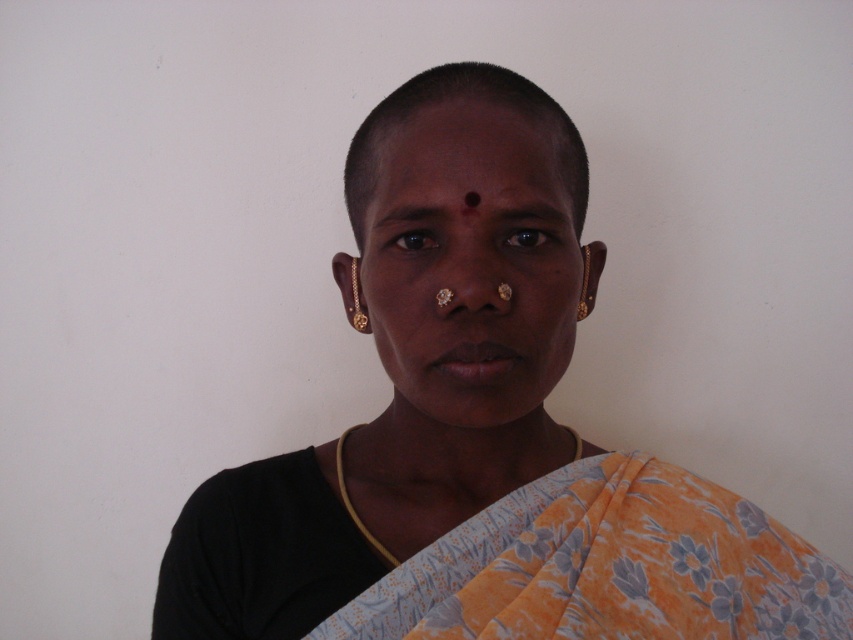
Who is taller, floral orange sari at lower center or matte gold nose ring at center?

Standing taller between the two is matte gold nose ring at center.

Between floral orange sari at lower center and matte gold nose ring at center, which one is positioned higher?

Positioned higher is matte gold nose ring at center.

Locate an element on the screen. floral orange sari at lower center is located at coordinates (608, 566).

Which is behind, point (378, 346) or point (431, 224)?

The point (378, 346) is more distant.

Can you confirm if matte gold nose ring at center is positioned to the left of brown smooth eyebrow at upper center?

In fact, matte gold nose ring at center is to the right of brown smooth eyebrow at upper center.

Is point (496, 406) positioned in front of point (439, 209)?

No.

The image size is (853, 640). What are the coordinates of `matte gold nose ring at center` in the screenshot? It's located at (469, 269).

Find the location of a particular element. The image size is (853, 640). matte black blouse at center is located at coordinates (479, 436).

Is point (368, 301) behind point (381, 616)?

Yes, it is.

Locate an element on the screen. Image resolution: width=853 pixels, height=640 pixels. matte black blouse at center is located at coordinates (479, 436).